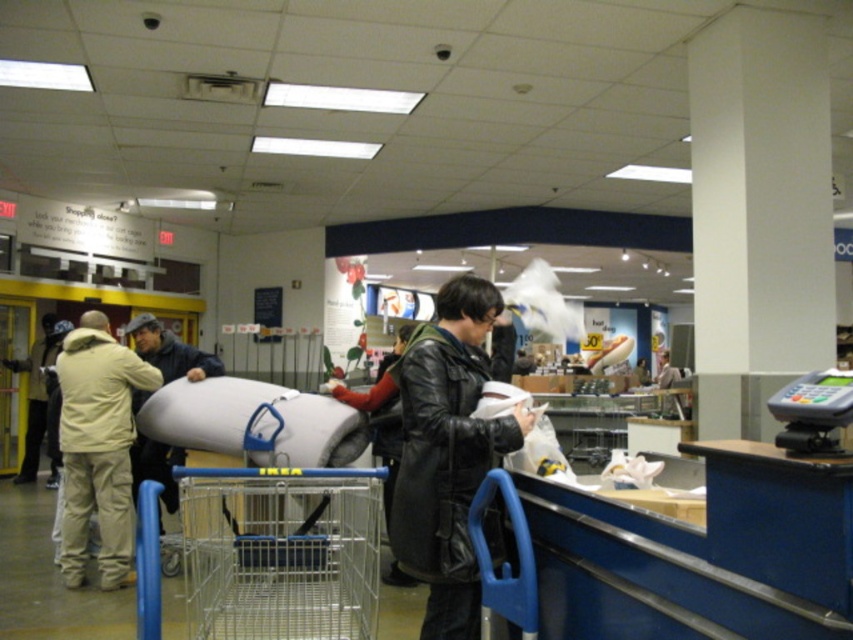
You are a customer in the store and want to place your dark blue jacket at center into the blue metal shopping cart at lower center. Can you fit it inside the cart?

The blue metal shopping cart at lower center is larger in size than the dark blue jacket at center, so yes, the dark blue jacket at center can fit inside the cart.

Based on the photo, you are a customer in the store and want to pick up both the black leather jacket at center and the beige wool jacket at left. Which jacket should you reach for first to get the one that is higher?

The black leather jacket at center is above the beige wool jacket at left, so you should reach for the black leather jacket at center first.